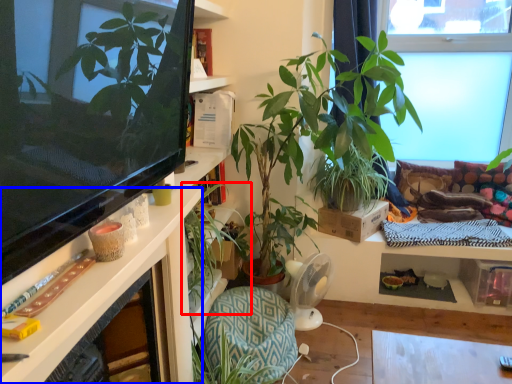
Question: Among these objects, which one is farthest to the camera, houseplant (highlighted by a red box) or desk (highlighted by a blue box)?

Choices:
 (A) houseplant
 (B) desk

Answer: (A)